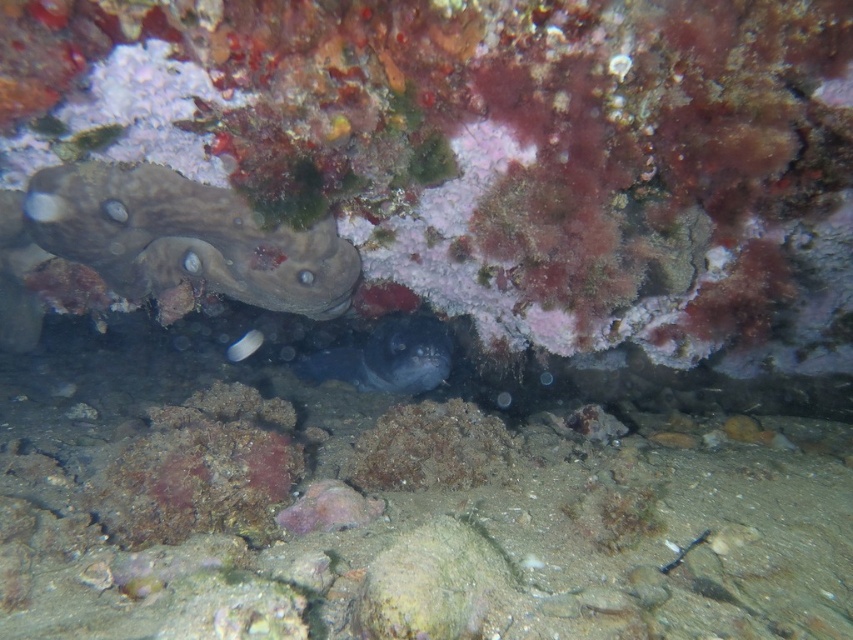
You are a scuba diver who wants to take a photo of the dark fish in the crevice. You have a camera with a 4.5 feet reach. Can you reach the smooth gray rock at left to stabilize yourself while taking the photo?

The smooth gray rock at left is 5.29 feet away from viewer, which is farther than the camera reach of 4.5 feet. Therefore, you cannot reach the smooth gray rock at left to stabilize yourself.

You are a marine biologist observing this underwater scene. You need to determine which object is wider between the smooth gray rock at left and the smooth dark gray fish at center. Which one is wider?

The smooth dark gray fish at center is wider than the smooth gray rock at left.

You are a marine biologist observing this underwater scene. You notice the smooth gray rock at left and the smooth dark gray fish at center. Which object is closer to you, the observer?

The smooth gray rock at left is closer to you because it is positioned in front of the smooth dark gray fish at center.